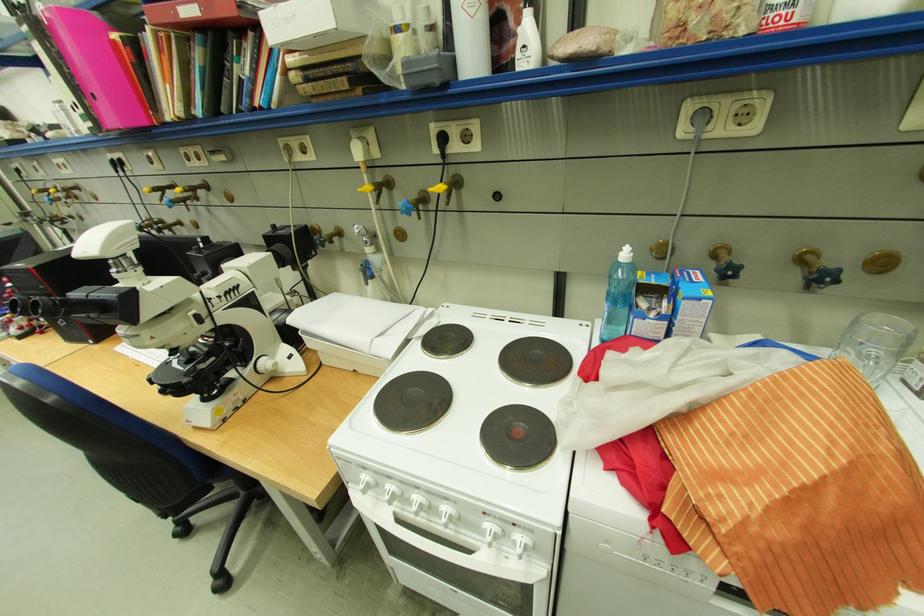
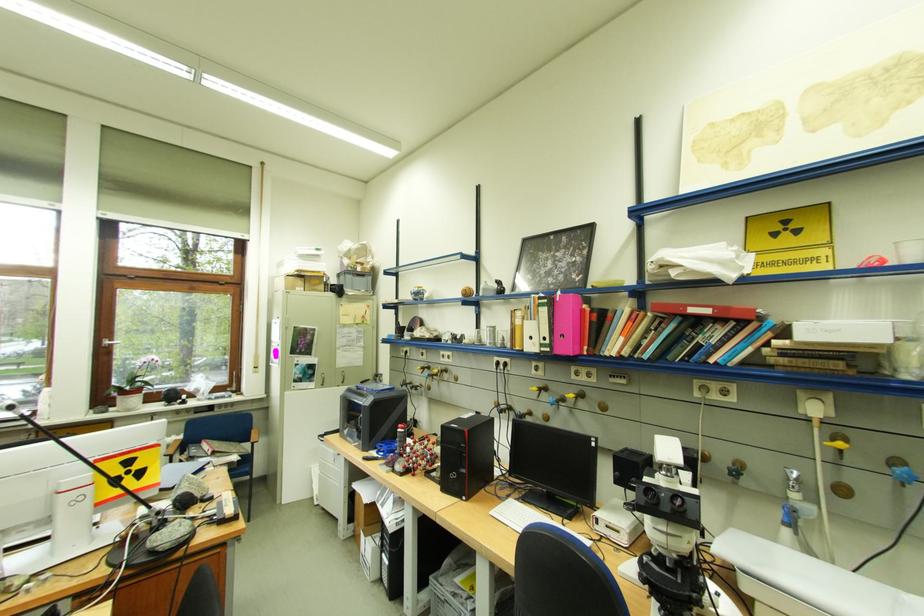
Where in the second image is the point corresponding to [305,143] from the first image?

(724, 387)